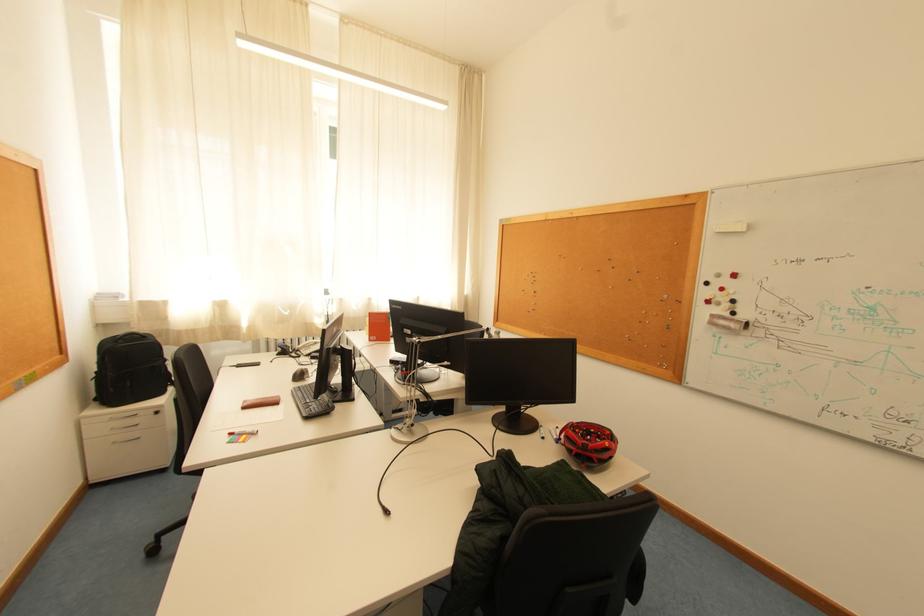
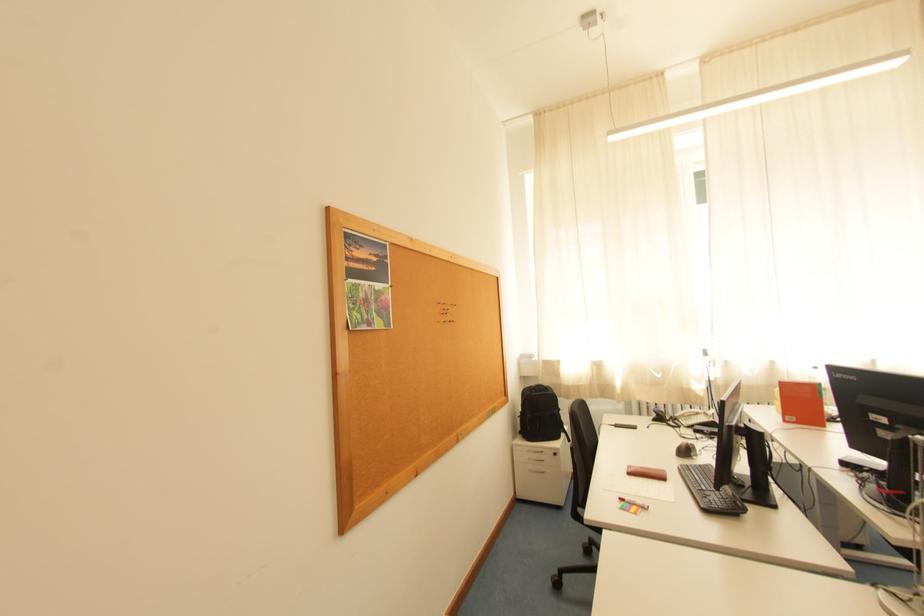
Find the pixel in the second image that matches the point at 312,416 in the first image.

(711, 508)